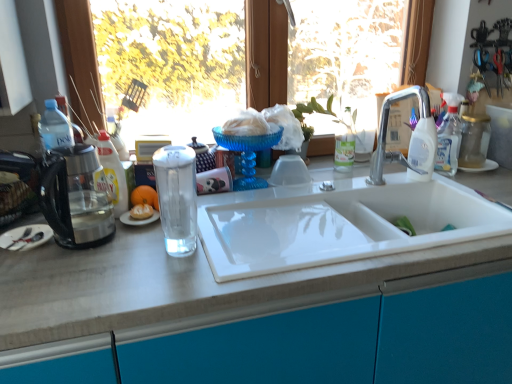
The image size is (512, 384). Find the location of `vacant location below translucent glass kettle at left (from a real-world perspective)`. vacant location below translucent glass kettle at left (from a real-world perspective) is located at coordinates (89, 246).